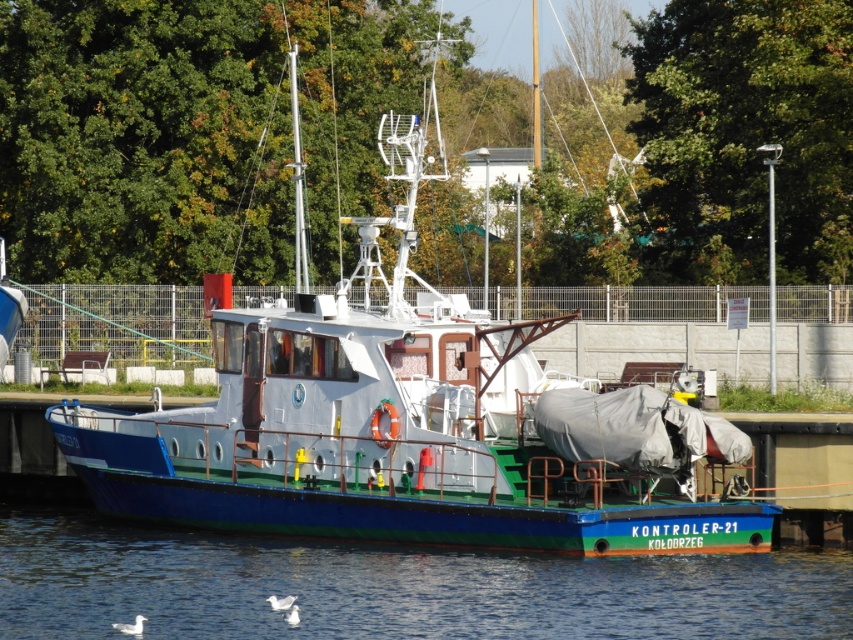
Identify the location of blue matte boat at center. The height and width of the screenshot is (640, 853). (413, 424).

Does point (144, 508) lie in front of point (379, 598)?

No, it is not.

Which is behind, point (432, 403) or point (64, 561)?

The point (64, 561) is more distant.

At what (x,y) coordinates should I click in order to perform the action: click on blue matte boat at center. Please return your answer as a coordinate pair (x, y). This screenshot has height=640, width=853. Looking at the image, I should click on (413, 424).